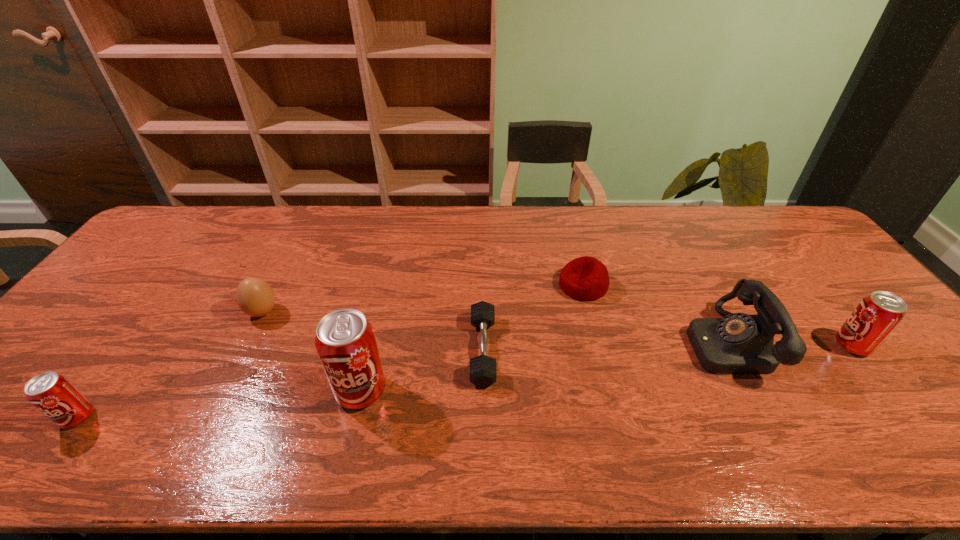
Where is `dumbbell`? dumbbell is located at coordinates (x=483, y=372).

Locate an element on the screen. The height and width of the screenshot is (540, 960). telephone is located at coordinates (739, 343).

Find the location of a particular element. This screenshot has height=540, width=960. free region located 0.170m on the right of the shortest soda is located at coordinates (170, 417).

The width and height of the screenshot is (960, 540). I want to click on vacant space situated on the right of the second soda from left to right, so click(450, 391).

Where is `free space located on the front of the second shortest soda`? The width and height of the screenshot is (960, 540). free space located on the front of the second shortest soda is located at coordinates (884, 386).

Where is `vacant space situated on the seat area of the third object from right to left`? This screenshot has width=960, height=540. vacant space situated on the seat area of the third object from right to left is located at coordinates (441, 285).

At what (x,y) coordinates should I click in order to perform the action: click on vacant space located on the seat area of the third object from right to left. Please return your answer as a coordinate pair (x, y). This screenshot has height=540, width=960. Looking at the image, I should click on (508, 285).

The height and width of the screenshot is (540, 960). Identify the location of free point located 0.120m on the seat area of the third object from right to left. (518, 285).

Image resolution: width=960 pixels, height=540 pixels. I want to click on free space located 0.340m on the right of the boiled egg, so click(401, 312).

This screenshot has width=960, height=540. Identify the location of vacant space located 0.280m on the back of the shortest object. (482, 252).